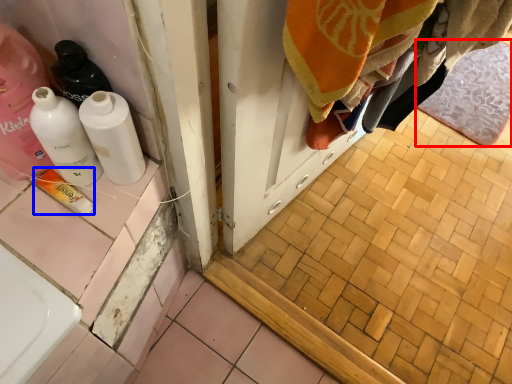
Question: Which object is closer to the camera taking this photo, bath mat (highlighted by a red box) or product (highlighted by a blue box)?

Choices:
 (A) bath mat
 (B) product

Answer: (B)